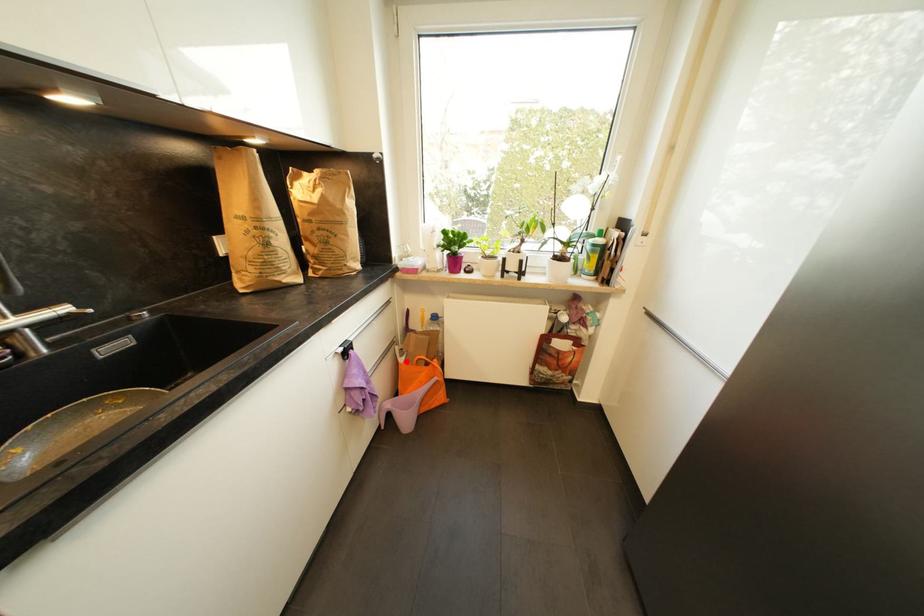
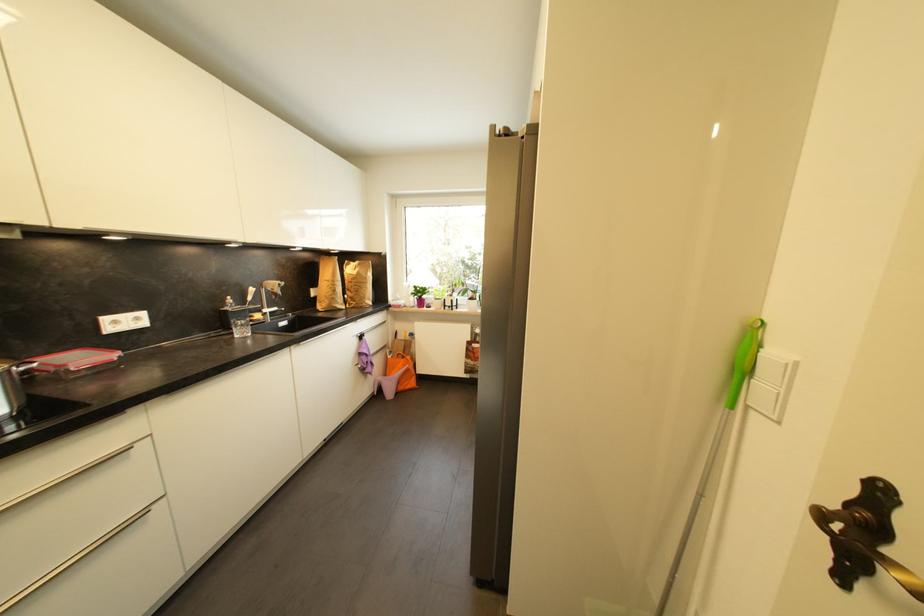
Locate, in the second image, the point that corresponds to the highlighted location in the first image.

(395, 359)